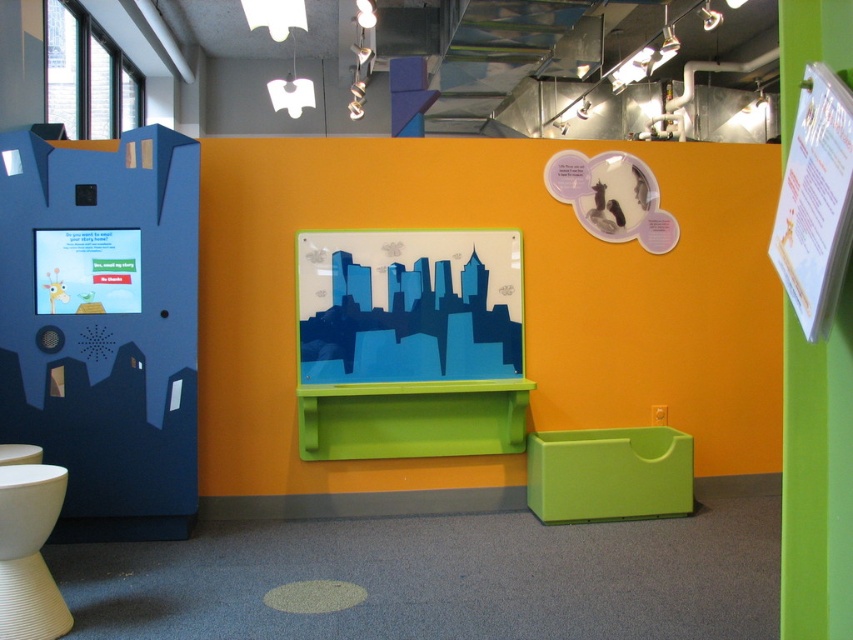
You are a parent trying to decide whether to place a large toy box between the blue glossy cityscape at center and the white matte toilet bowl at lower left. Given that the toy box requires 1.2 meters of space, can you determine if there is enough space between them?

The blue glossy cityscape at center is larger in size than the white matte toilet bowl at lower left, but the exact distance between them isn not specified. Therefore, it is uncertain if there is enough space for the toy box requiring 1.2 meters.